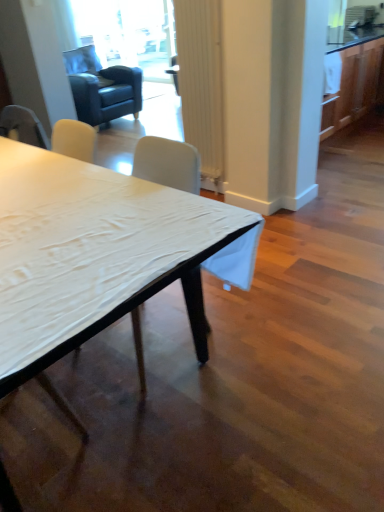
At what (x,y) coordinates should I click in order to perform the action: click on vacant area that lies to the right of white fabric chair at center. Please return your answer as a coordinate pair (x, y). Looking at the image, I should click on (254, 336).